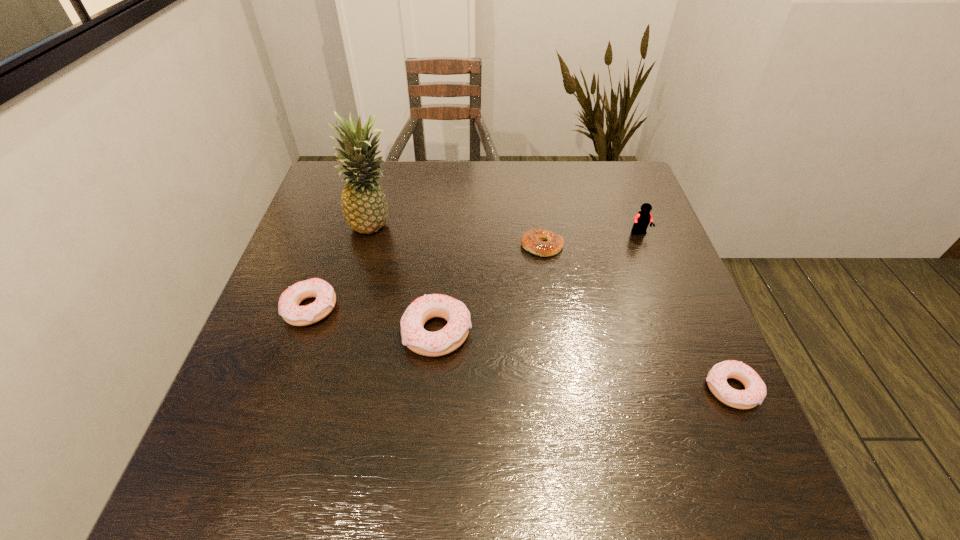
You are a GUI agent. You are given a task and a screenshot of the screen. Output one action in this format:
    pyautogui.click(x=<x>, y=<y>)
    Task: Click on the free point between the second shortest doughnut and the nearest doughnut
    
    Given the screenshot: What is the action you would take?
    pyautogui.click(x=521, y=349)

Locate an element on the screen. The width and height of the screenshot is (960, 540). vacant area that lies between the nearest object and the third tallest object is located at coordinates (584, 361).

Locate an element on the screen. This screenshot has width=960, height=540. free space between the tallest object and the nearest doughnut is located at coordinates (553, 308).

Locate an element on the screen. Image resolution: width=960 pixels, height=540 pixels. free spot between the tallest object and the bagel is located at coordinates (458, 236).

The width and height of the screenshot is (960, 540). Find the location of `vacant space that's between the nearest object and the fourth object from left to right`. vacant space that's between the nearest object and the fourth object from left to right is located at coordinates (636, 318).

In order to click on vacant space in between the second tallest object and the rightmost doughnut in this screenshot , I will do `click(685, 311)`.

What are the coordinates of `vacant point located between the leftmost doughnut and the third object from left to right` in the screenshot? It's located at (374, 320).

The width and height of the screenshot is (960, 540). I want to click on free space between the nearest object and the second doughnut from left to right, so click(x=584, y=361).

Where is `the fourth closest object relative to the Lego`? The width and height of the screenshot is (960, 540). the fourth closest object relative to the Lego is located at coordinates (364, 206).

Find the location of `object that stands as the fourth closest to the Lego`. object that stands as the fourth closest to the Lego is located at coordinates (364, 206).